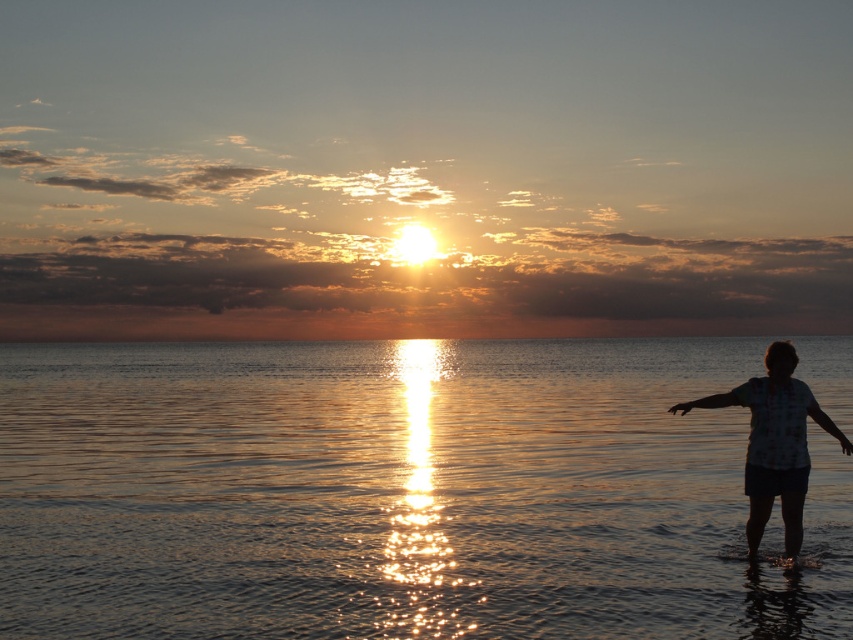
Question: Which of the following is the farthest from the observer?

Choices:
 (A) (300, 342)
 (B) (779, 364)

Answer: (A)

Question: Among these points, which one is nearest to the camera?

Choices:
 (A) (820, 417)
 (B) (728, 518)

Answer: (A)

Question: Does glistening water at center have a smaller size compared to silhouette fabric at right?

Choices:
 (A) yes
 (B) no

Answer: (B)

Question: Which point is farther to the camera?

Choices:
 (A) silhouette fabric at right
 (B) glistening water at center

Answer: (A)

Question: Is the position of glistening water at center more distant than that of silhouette fabric at right?

Choices:
 (A) yes
 (B) no

Answer: (B)

Question: Does glistening water at center have a larger size compared to silhouette fabric at right?

Choices:
 (A) no
 (B) yes

Answer: (B)